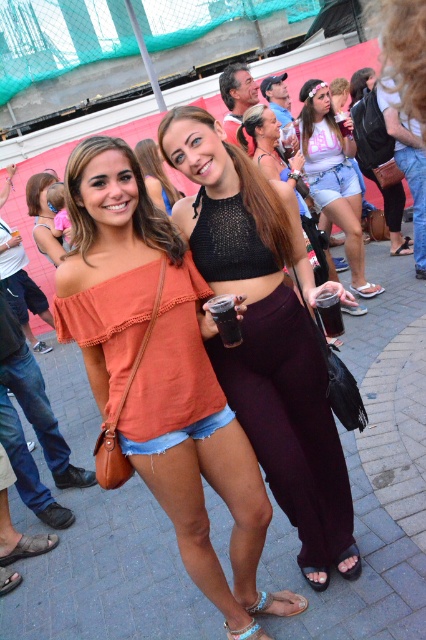
Who is taller, matte black top at center or blue fabric sandal at lower center?

matte black top at center

Can you confirm if matte black top at center is thinner than blue fabric sandal at lower center?

In fact, matte black top at center might be wider than blue fabric sandal at lower center.

Identify the location of matte black top at center. Image resolution: width=426 pixels, height=640 pixels. (155, 176).

Where is `matte black top at center`? matte black top at center is located at coordinates (155, 176).

Who is shorter, black mesh bikini top at center or matte black top at upper left?

matte black top at upper left is shorter.

Does black mesh bikini top at center come behind matte black top at upper left?

No.

Between point (222, 289) and point (34, 205), which one is positioned in front?

Point (222, 289)

Identify the location of black mesh bikini top at center. (267, 333).

Find the location of `black plastic cup at center`. black plastic cup at center is located at coordinates (226, 320).

Is black plastic cup at center closer to the viewer compared to dark matte glass at center?

That is False.

Does point (224, 298) come closer to viewer compared to point (316, 310)?

Yes, point (224, 298) is closer to viewer.

Where is `black plastic cup at center`? black plastic cup at center is located at coordinates (226, 320).